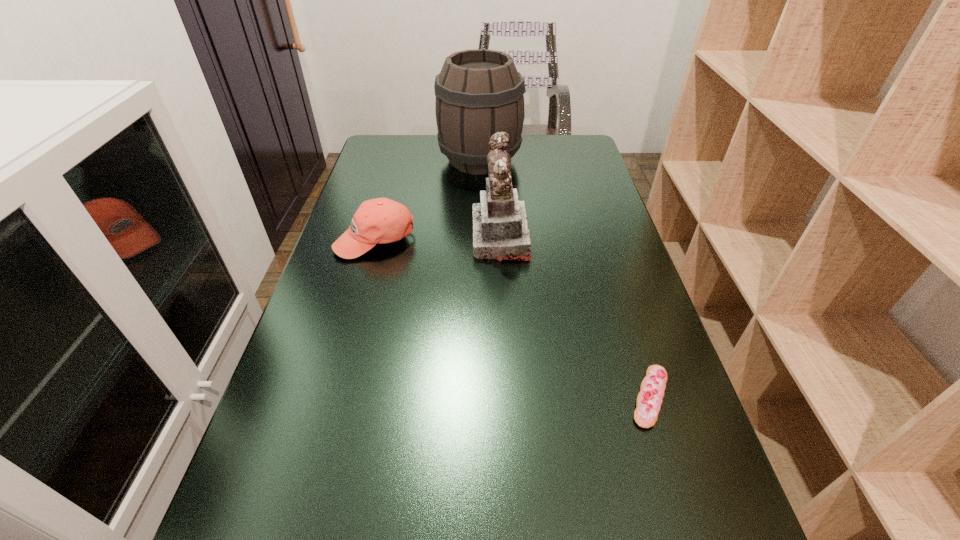
Image resolution: width=960 pixels, height=540 pixels. What are the coordinates of `free location located 0.220m on the front of the baseball cap` in the screenshot? It's located at (349, 330).

Where is `free space located on the back of the shortest object`? free space located on the back of the shortest object is located at coordinates 632,339.

The width and height of the screenshot is (960, 540). What are the coordinates of `object at the far edge` in the screenshot? It's located at (479, 92).

What are the coordinates of `object at the left edge` in the screenshot? It's located at (381, 220).

This screenshot has height=540, width=960. I want to click on object at the right edge, so click(649, 400).

The width and height of the screenshot is (960, 540). In the image, there is a desktop. Find the location of `vacant space at the far edge`. vacant space at the far edge is located at coordinates (513, 163).

In the image, there is a desktop. Identify the location of free space at the left edge. [x=359, y=374].

The height and width of the screenshot is (540, 960). In the image, there is a desktop. In order to click on free space at the right edge in this screenshot , I will do `click(679, 442)`.

Identify the location of free space at the far left corner. (370, 160).

Find the location of `unoccupied area between the wine bucket and the third tallest object`. unoccupied area between the wine bucket and the third tallest object is located at coordinates (427, 200).